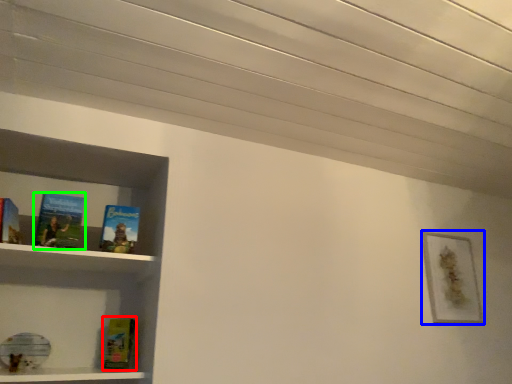
Question: Based on their relative distances, which object is farther from paperback book (highlighted by a red box)? Choose from picture frame (highlighted by a blue box) and book (highlighted by a green box).

Choices:
 (A) picture frame
 (B) book

Answer: (A)